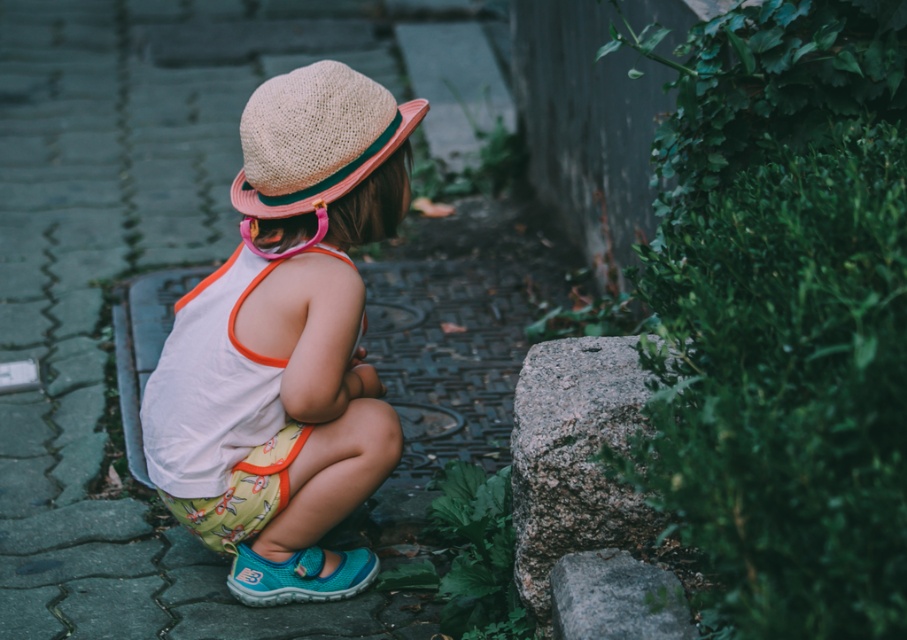
Between matte straw hat at center and straw hat at center, which one is positioned lower?

Positioned lower is matte straw hat at center.

This screenshot has width=907, height=640. What do you see at coordinates (286, 342) in the screenshot?
I see `matte straw hat at center` at bounding box center [286, 342].

Identify the location of matte straw hat at center. This screenshot has height=640, width=907. (286, 342).

Is gray cobblestone pavement at center wider than gray rough stone at lower right?

Yes, gray cobblestone pavement at center is wider than gray rough stone at lower right.

Between gray cobblestone pavement at center and gray rough stone at lower right, which one is positioned lower?

Positioned lower is gray rough stone at lower right.

Is point (392, 376) closer to viewer compared to point (617, 636)?

No, (392, 376) is behind (617, 636).

At what (x,y) coordinates should I click in order to perform the action: click on gray cobblestone pavement at center. Please return your answer as a coordinate pair (x, y). The width and height of the screenshot is (907, 640). Looking at the image, I should click on (127, 275).

Does granite rock at lower right have a lesser width compared to gray rough stone at lower right?

No.

Looking at this image, who is taller, granite rock at lower right or gray rough stone at lower right?

granite rock at lower right is taller.

The height and width of the screenshot is (640, 907). Identify the location of granite rock at lower right. point(584,497).

Find the location of a particular element. This screenshot has height=640, width=907. granite rock at lower right is located at coordinates (584, 497).